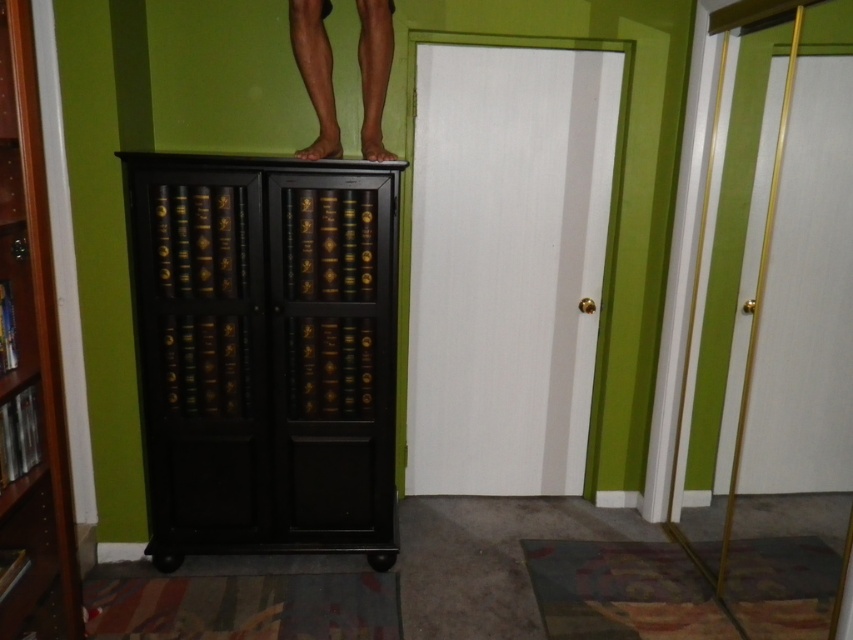
Describe the element at coordinates (265, 353) in the screenshot. I see `black wood cabinet at upper center` at that location.

Which is more to the right, black wood cabinet at upper center or black wood bookcase at left?

black wood cabinet at upper center

Image resolution: width=853 pixels, height=640 pixels. Describe the element at coordinates (265, 353) in the screenshot. I see `black wood cabinet at upper center` at that location.

The width and height of the screenshot is (853, 640). What are the coordinates of `black wood cabinet at upper center` in the screenshot? It's located at (265, 353).